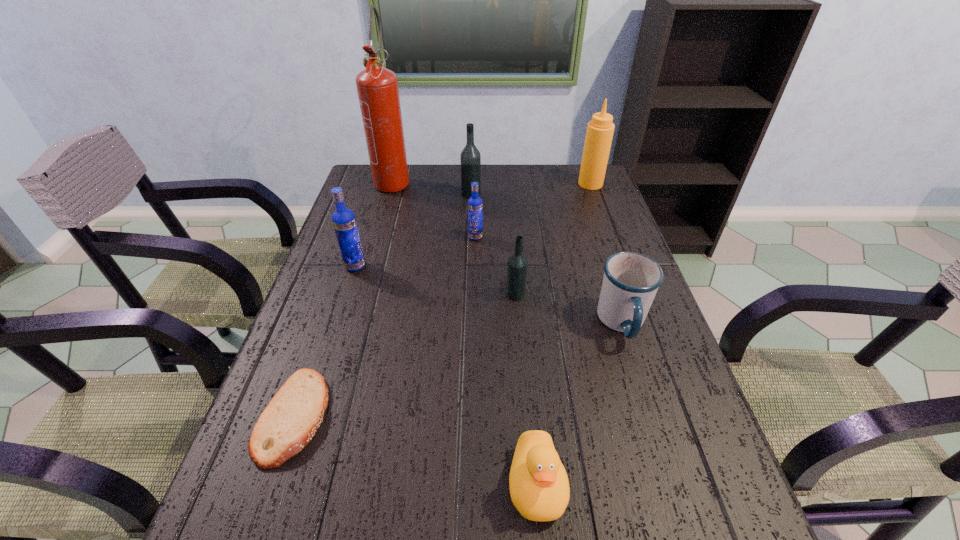
Select which vodka appears as the third closest to the leftmost vodka. Please provide its 2D coordinates. Your answer should be formatted as a tuple, i.e. [(x, y)], where the tuple contains the x and y coordinates of a point satisfying the conditions above.

[(470, 158)]

Identify the location of vacant space that satisfies the following two spatial constraints: 1. from the nozzle of the rightmost vodka; 2. on the left side of the tallest object. (360, 294).

At what (x,y) coordinates should I click in order to perform the action: click on free location that satisfies the following two spatial constraints: 1. on the front side of the nearest vodka; 2. on the right side of the left blue vodka. Please return your answer as a coordinate pair (x, y). This screenshot has width=960, height=540. Looking at the image, I should click on (346, 294).

I want to click on free spot that satisfies the following two spatial constraints: 1. on the back side of the left black vodka; 2. on the left side of the shortest object, so click(x=372, y=193).

In order to click on blank space that satisfies the following two spatial constraints: 1. from the nozzle of the condiment; 2. on the right side of the red fire extinguisher in this screenshot , I will do `click(393, 184)`.